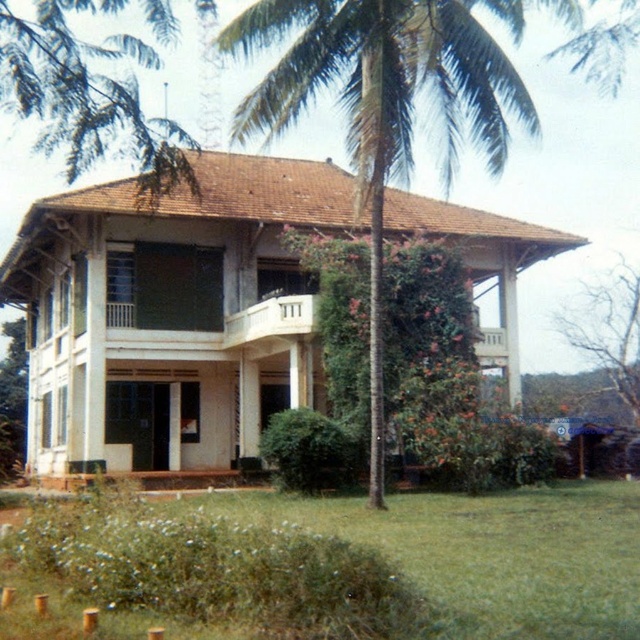
Does white painted wood gazebo at center appear on the right side of green leafy tree at upper left?

Indeed, white painted wood gazebo at center is positioned on the right side of green leafy tree at upper left.

Consider the image. Is white painted wood gazebo at center to the left of green leafy tree at upper left from the viewer's perspective?

Incorrect, white painted wood gazebo at center is not on the left side of green leafy tree at upper left.

Which is behind, point (38, 253) or point (177, 22)?

The point (38, 253) is behind.

I want to click on white painted wood gazebo at center, so click(170, 314).

Who is more forward, (512, 493) or (636, 394)?

Positioned in front is point (512, 493).

Does green grass at lower center come in front of bare branches at upper right?

Yes, green grass at lower center is in front of bare branches at upper right.

The width and height of the screenshot is (640, 640). I want to click on green grass at lower center, so click(496, 550).

Locate an element on the screen. Image resolution: width=640 pixels, height=640 pixels. green leafy palm tree at center is located at coordinates (385, 102).

Can you confirm if green leafy palm tree at center is shorter than green grass at lower center?

No, green leafy palm tree at center is not shorter than green grass at lower center.

Identify the location of green leafy palm tree at center. The image size is (640, 640). (385, 102).

This screenshot has width=640, height=640. I want to click on green leafy palm tree at center, so click(385, 102).